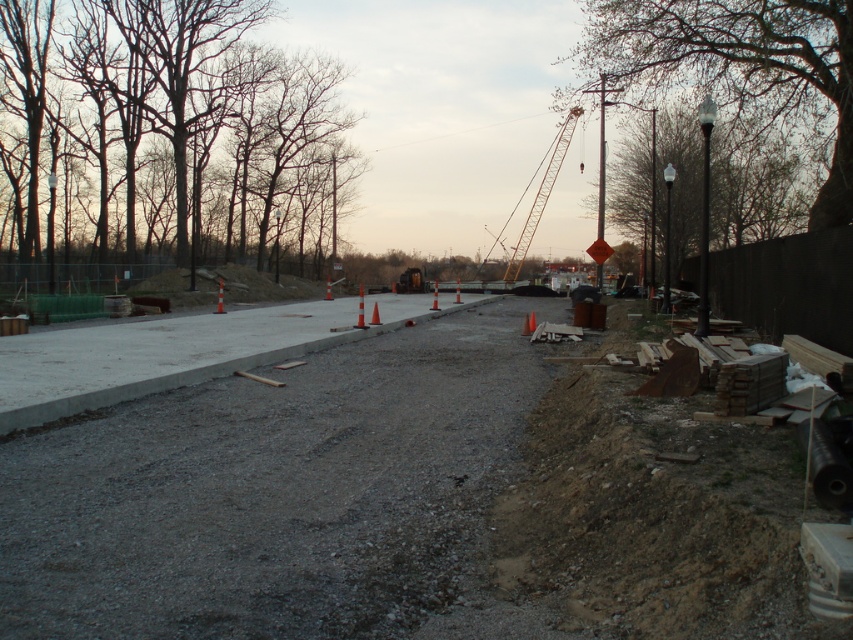
Question: Which of the following is the closest to the observer?

Choices:
 (A) (416, 572)
 (B) (109, 72)
 (C) (735, 182)

Answer: (A)

Question: Is brown bark trees at upper left to the right of smooth gray tree at right from the viewer's perspective?

Choices:
 (A) no
 (B) yes

Answer: (A)

Question: Based on their relative distances, which object is nearer to the gray concrete pavement at center?

Choices:
 (A) yellow metallic crane at center
 (B) green leafy tree at upper right
 (C) brown bark trees at upper left
 (D) smooth gray tree at right

Answer: (B)

Question: Does gray concrete pavement at center appear under smooth gray tree at right?

Choices:
 (A) yes
 (B) no

Answer: (A)

Question: Which of the following is the closest to the observer?

Choices:
 (A) yellow metallic crane at center
 (B) brown bark trees at upper left
 (C) gray concrete pavement at center

Answer: (C)

Question: Is brown bark trees at upper left to the left of green leafy tree at upper right from the viewer's perspective?

Choices:
 (A) yes
 (B) no

Answer: (A)